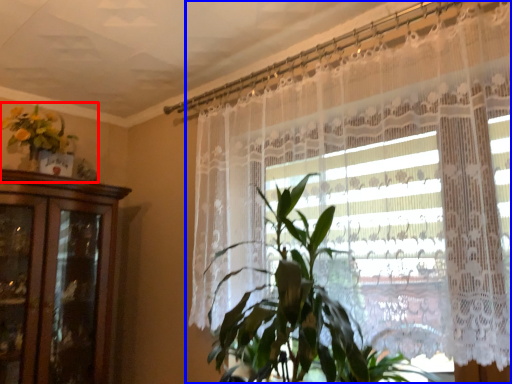
Question: Among these objects, which one is farthest to the camera, floral arrangement (highlighted by a red box) or curtain (highlighted by a blue box)?

Choices:
 (A) floral arrangement
 (B) curtain

Answer: (A)